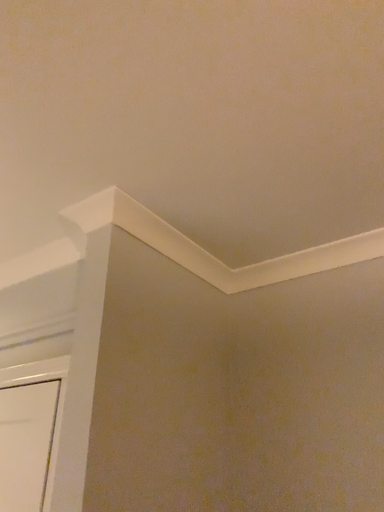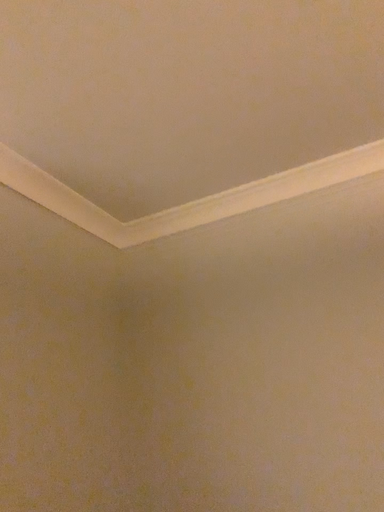
Question: How did the camera likely rotate when shooting the video?

Choices:
 (A) rotated right
 (B) rotated left

Answer: (A)